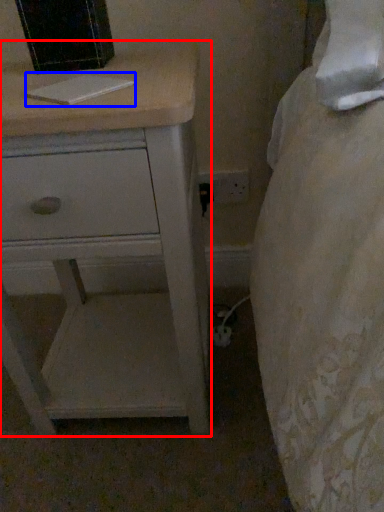
Question: Which point is closer to the camera, chest of drawers (highlighted by a red box) or book (highlighted by a blue box)?

Choices:
 (A) chest of drawers
 (B) book

Answer: (A)